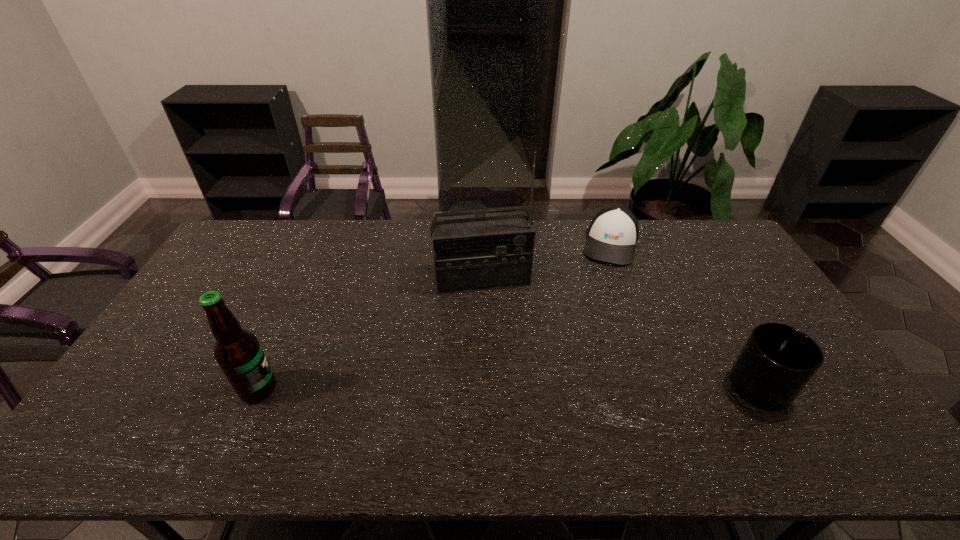
The width and height of the screenshot is (960, 540). What are the coordinates of `vacant space at the far edge` in the screenshot? It's located at (666, 224).

In the image, there is a desktop. Where is `vacant space at the near edge`? vacant space at the near edge is located at coordinates (599, 397).

What are the coordinates of `vacant space at the right edge of the desktop` in the screenshot? It's located at pyautogui.click(x=714, y=269).

I want to click on free space at the far left corner, so click(268, 228).

Locate an element on the screen. The width and height of the screenshot is (960, 540). free space at the near left corner of the desktop is located at coordinates (125, 416).

Where is `vacant space at the far right corner of the desktop`? The height and width of the screenshot is (540, 960). vacant space at the far right corner of the desktop is located at coordinates (693, 224).

Where is `free point between the rightmost object and the third object from left to right`? free point between the rightmost object and the third object from left to right is located at coordinates (689, 315).

The height and width of the screenshot is (540, 960). I want to click on vacant region between the tallest object and the mug, so click(625, 333).

The image size is (960, 540). I want to click on vacant area that lies between the third object from left to right and the radio receiver, so click(x=546, y=261).

You are a GUI agent. You are given a task and a screenshot of the screen. Output one action in this format:
    pyautogui.click(x=<x>, y=<y>)
    Task: Click on the free point between the rightmost object and the leftmost object
    Image resolution: width=960 pixels, height=540 pixels.
    Given the screenshot: What is the action you would take?
    pyautogui.click(x=514, y=388)